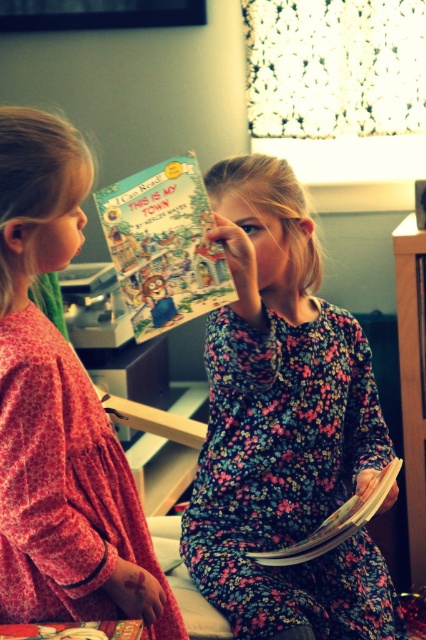
Question: From the image, what is the correct spatial relationship of floral-patterned dress at center in relation to floral pajamas at left?

Choices:
 (A) right
 (B) left

Answer: (A)

Question: Considering the real-world distances, which object is closest to the floral pajamas at left?

Choices:
 (A) hardcover book at center
 (B) matte paper book at center
 (C) wooden at right

Answer: (B)

Question: Is floral-patterned dress at center above matte paper book at center?

Choices:
 (A) no
 (B) yes

Answer: (A)

Question: Which of the following is the farthest from the observer?

Choices:
 (A) hardcover book at center
 (B) matte paper book at center
 (C) wooden at right
 (D) floral pajamas at left

Answer: (C)

Question: Which point is farther to the camera?

Choices:
 (A) (3, 429)
 (B) (2, 636)
 (C) (420, 456)

Answer: (C)

Question: From the image, what is the correct spatial relationship of matte paper book at center in relation to floral-patterned book at center?

Choices:
 (A) left
 (B) right

Answer: (A)